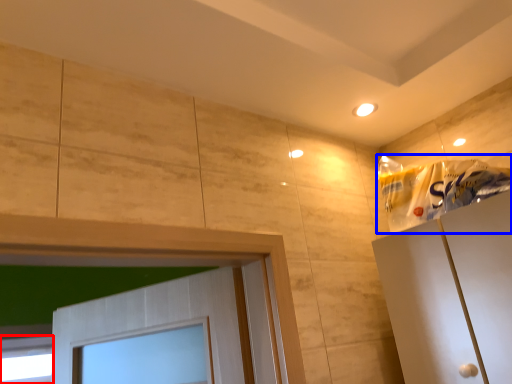
Question: Which object appears farthest to the camera in this image, window (highlighted by a red box) or material (highlighted by a blue box)?

Choices:
 (A) window
 (B) material

Answer: (A)